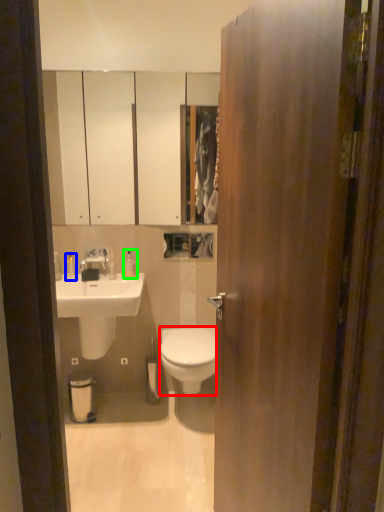
Question: Estimate the real-world distances between objects in this image. Which object is closer to bidet (highlighted by a red box), toiletry (highlighted by a blue box) or toiletry (highlighted by a green box)?

Choices:
 (A) toiletry
 (B) toiletry

Answer: (B)